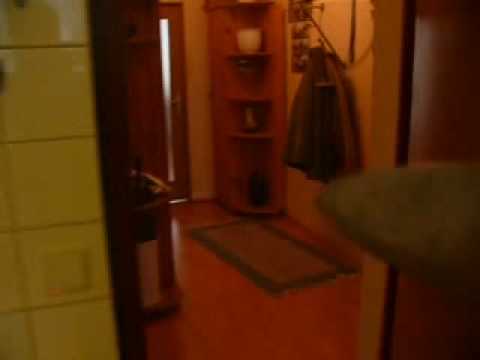
Find the location of `switch`. switch is located at coordinates (76, 273).